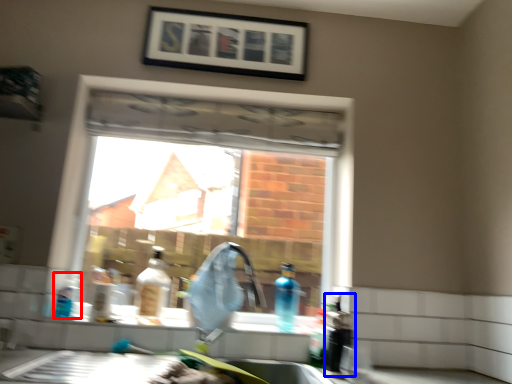
Question: Which point is closer to the camera, bottle (highlighted by a red box) or bottle (highlighted by a blue box)?

Choices:
 (A) bottle
 (B) bottle

Answer: (B)